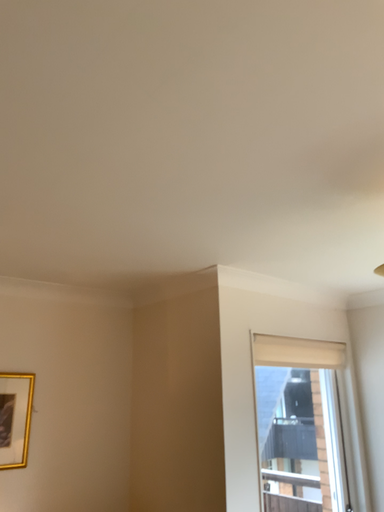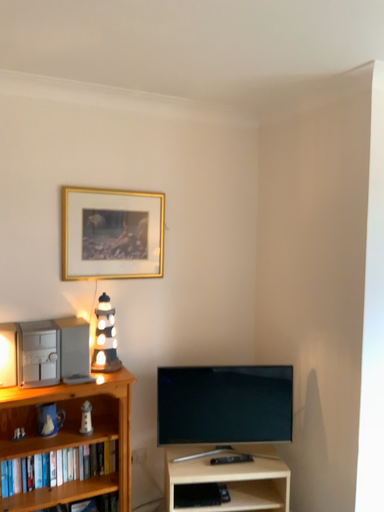
Question: Which way did the camera rotate in the video?

Choices:
 (A) rotated upward
 (B) rotated downward

Answer: (B)